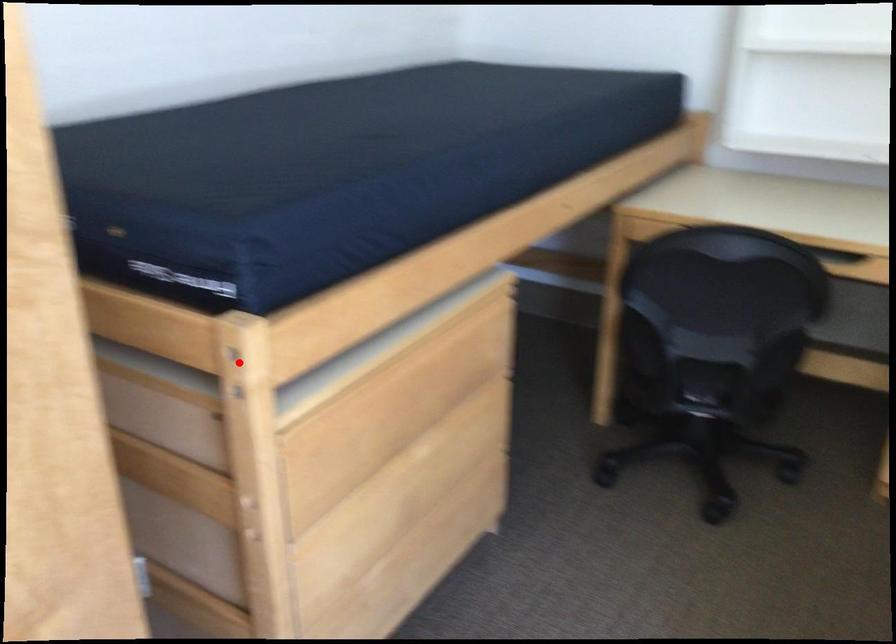
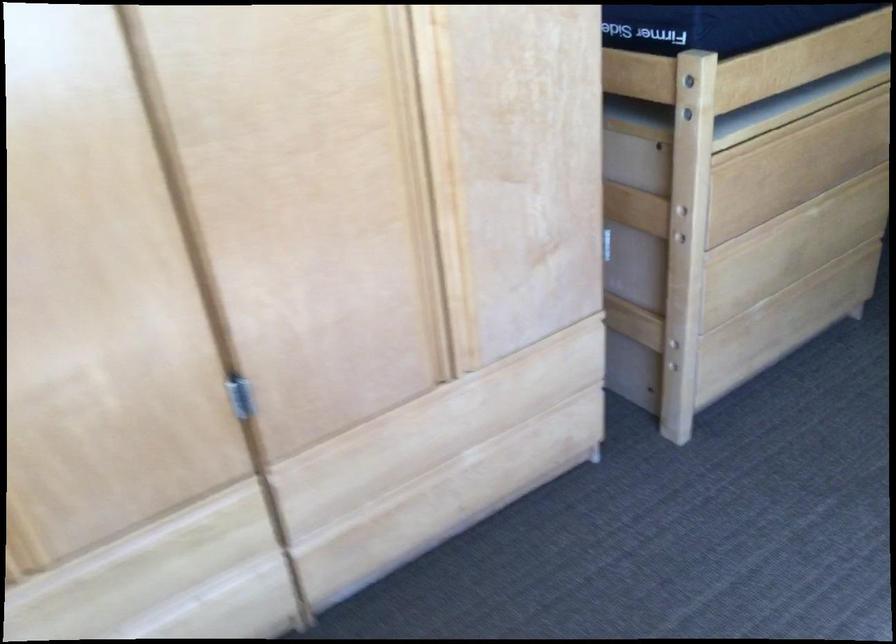
Locate, in the second image, the point that corresponds to the highlighted location in the first image.

(687, 82)